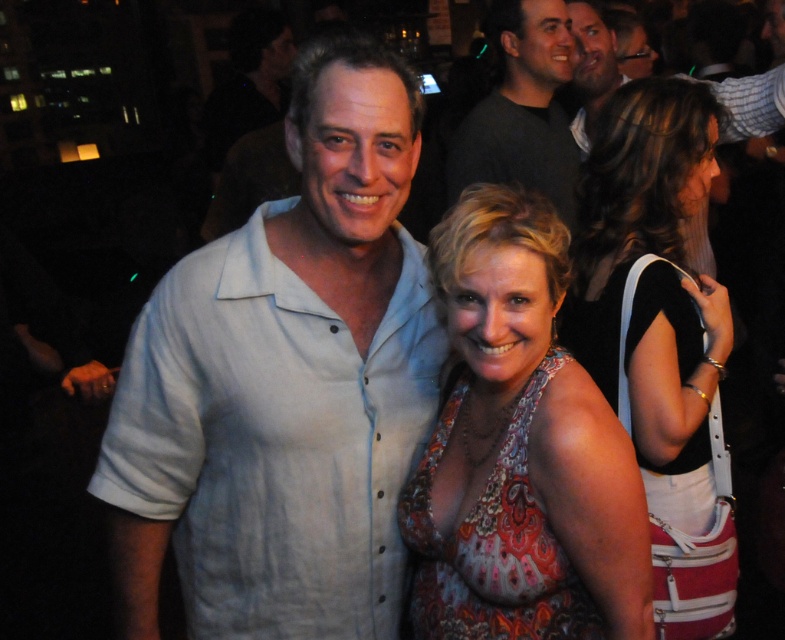
Question: Is light blue linen shirt at center behind floral-patterned dress at center?

Choices:
 (A) yes
 (B) no

Answer: (A)

Question: Based on their relative distances, which object is nearer to the dark gray shirt at upper center?

Choices:
 (A) black leather purse at right
 (B) floral-patterned dress at center
 (C) smooth skin face at upper center
 (D) light blue linen shirt at center

Answer: (C)

Question: Among these points, which one is farthest from the camera?

Choices:
 (A) (674, 262)
 (B) (568, 429)
 (C) (349, 84)

Answer: (A)

Question: Can you confirm if light blue linen shirt at center is thinner than smooth skin face at upper center?

Choices:
 (A) yes
 (B) no

Answer: (B)

Question: Where is light blue linen shirt at center located in relation to dark gray shirt at upper center in the image?

Choices:
 (A) below
 (B) above

Answer: (A)

Question: Which point appears closest to the camera in this image?

Choices:
 (A) (382, 620)
 (B) (517, 61)
 (C) (698, 300)
 (D) (477, 332)

Answer: (D)